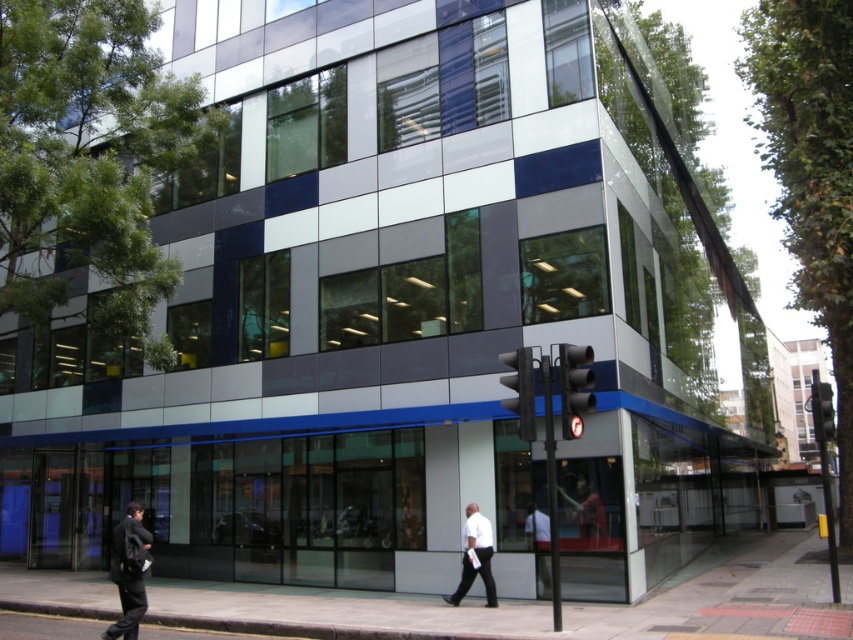
You are standing on the sidewalk in front of the modern building and want to walk to the entrance. There are two points marked on the sidewalk. One is at point coordinates point (x=602, y=605) and the other is at point coordinates point (x=129, y=593). Which point should you approach first if you want to reach the entrance quickly?

Point (x=129, y=593) should be approached first because point (x=602, y=605) is behind it, so moving towards the closer point will lead you to the entrance more quickly.

You are standing on the sidewalk in front of the modern building. You notice a point marked at coordinates (128, 573). Which object is located at that point?

The point at coordinates (128, 573) marks the dark gray suit at lower left.

You are standing at the entrance of the modern building and want to walk to the smooth concrete pavement at lower center. According to the image, where should you head to reach it?

The smooth concrete pavement at lower center is located at point [541,604], so you should head towards that coordinate to reach it.